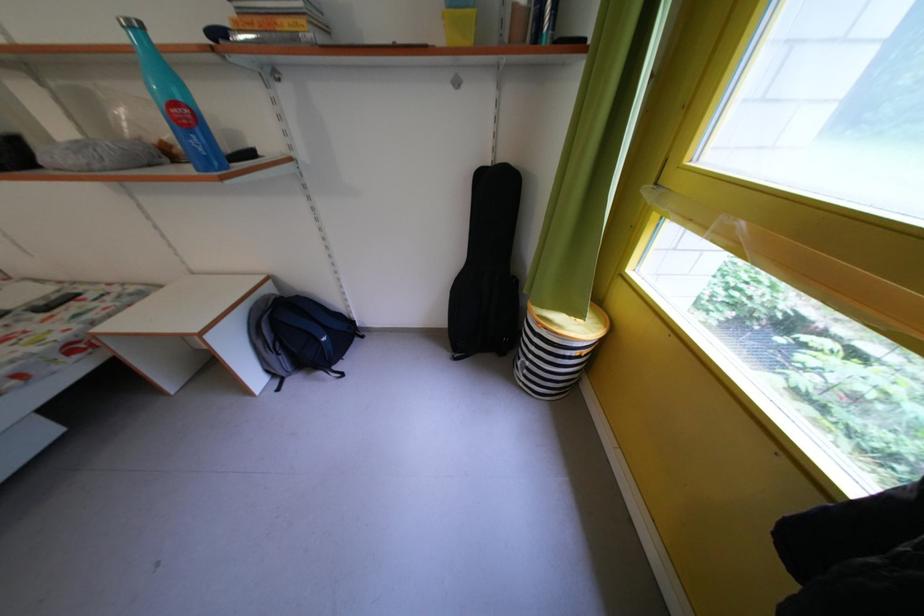
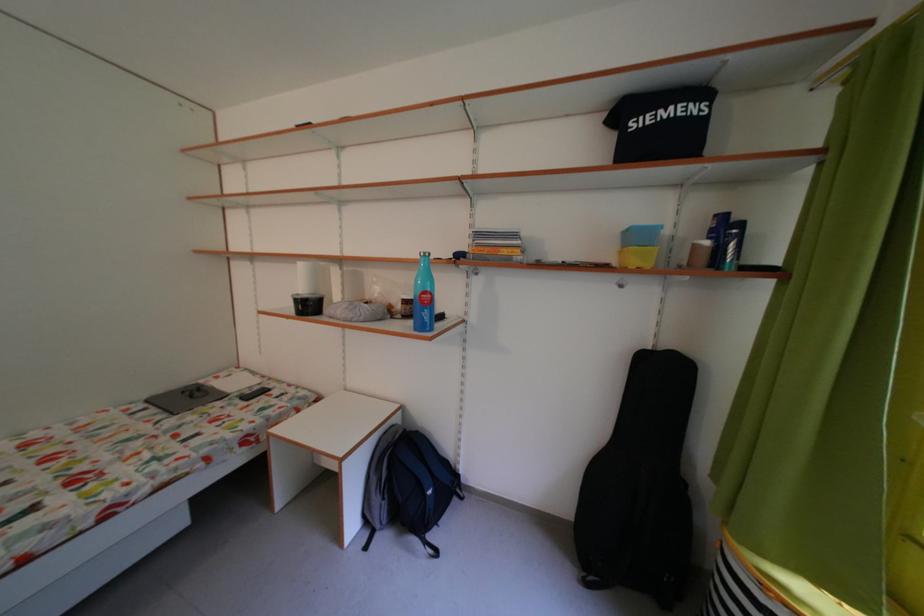
In the second image, find the point that corresponds to [499,171] in the first image.

(661, 354)